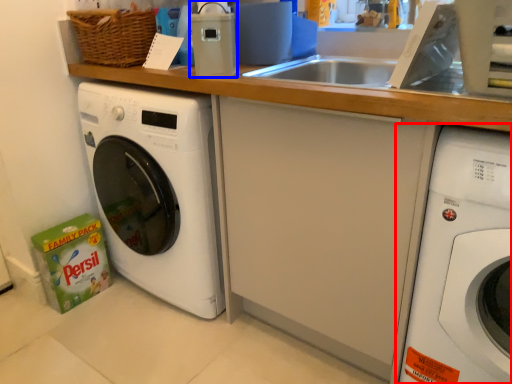
Question: Which object is closer to the camera taking this photo, washing machine (highlighted by a red box) or appliance (highlighted by a blue box)?

Choices:
 (A) washing machine
 (B) appliance

Answer: (A)